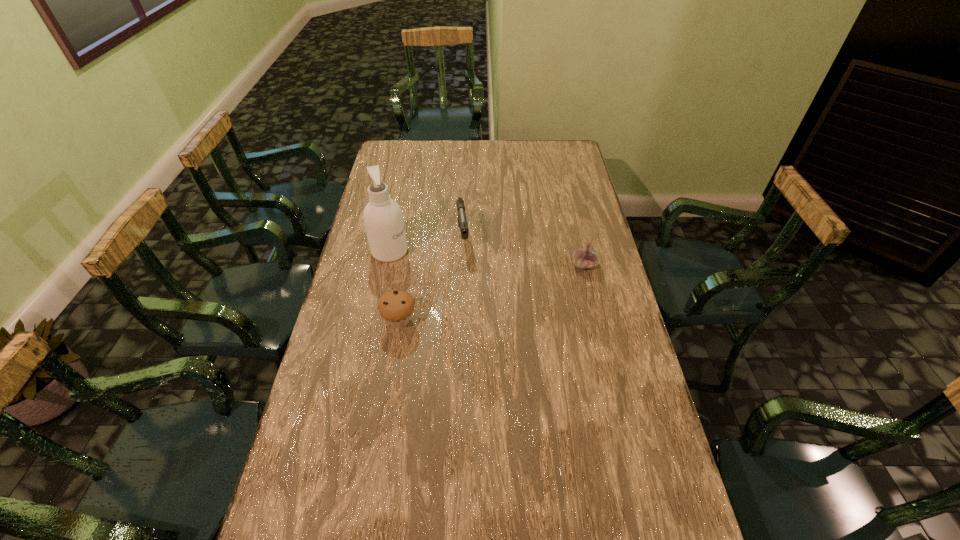
The image size is (960, 540). Identify the location of muffin. (396, 307).

The width and height of the screenshot is (960, 540). I want to click on the rightmost object, so click(x=586, y=257).

You are a GUI agent. You are given a task and a screenshot of the screen. Output one action in this format:
    pyautogui.click(x=<x>, y=<y>)
    Task: Click on the gun
    The height and width of the screenshot is (540, 960).
    Given the screenshot: What is the action you would take?
    pyautogui.click(x=462, y=219)

This screenshot has height=540, width=960. Find the location of `the tallest object`. the tallest object is located at coordinates (383, 219).

Locate an element on the screen. The image size is (960, 540). vacant area situated on the back of the nearest object is located at coordinates (409, 261).

Identify the location of vacant space located on the front of the rightmost object. (599, 324).

Image resolution: width=960 pixels, height=540 pixels. I want to click on vacant area located in the direction the gun is aimed, so click(468, 293).

At what (x,y) coordinates should I click in order to perform the action: click on free space located 0.090m in the direction the gun is aimed. Please return your answer as a coordinate pair (x, y). Image resolution: width=960 pixels, height=540 pixels. Looking at the image, I should click on (466, 272).

Image resolution: width=960 pixels, height=540 pixels. I want to click on vacant region located in the direction the gun is aimed, so click(475, 338).

I want to click on free location located 0.150m on the front label of the tallest object, so click(444, 266).